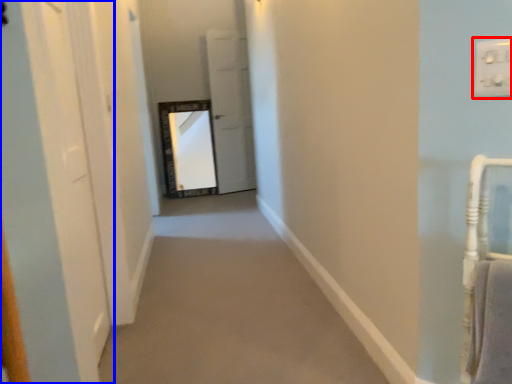
Question: Which point is closer to the camera, electric outlet (highlighted by a red box) or door (highlighted by a blue box)?

Choices:
 (A) electric outlet
 (B) door

Answer: (A)